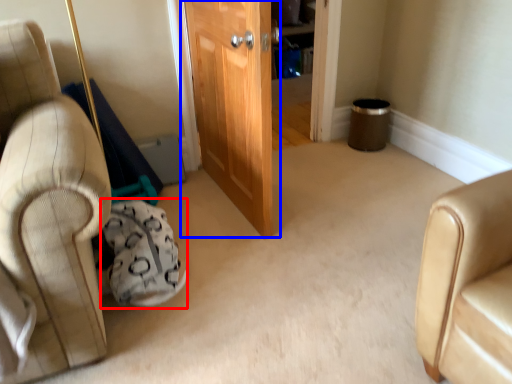
Question: Which of the following is the closest to the observer, bean bag chair (highlighted by a red box) or door (highlighted by a blue box)?

Choices:
 (A) bean bag chair
 (B) door

Answer: (A)